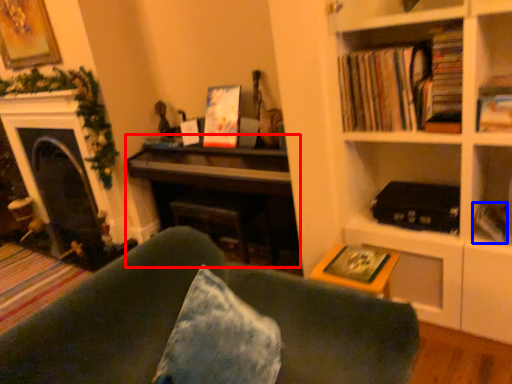
Question: Among these objects, which one is farthest to the camera, piano (highlighted by a red box) or paperback book (highlighted by a blue box)?

Choices:
 (A) piano
 (B) paperback book

Answer: (A)